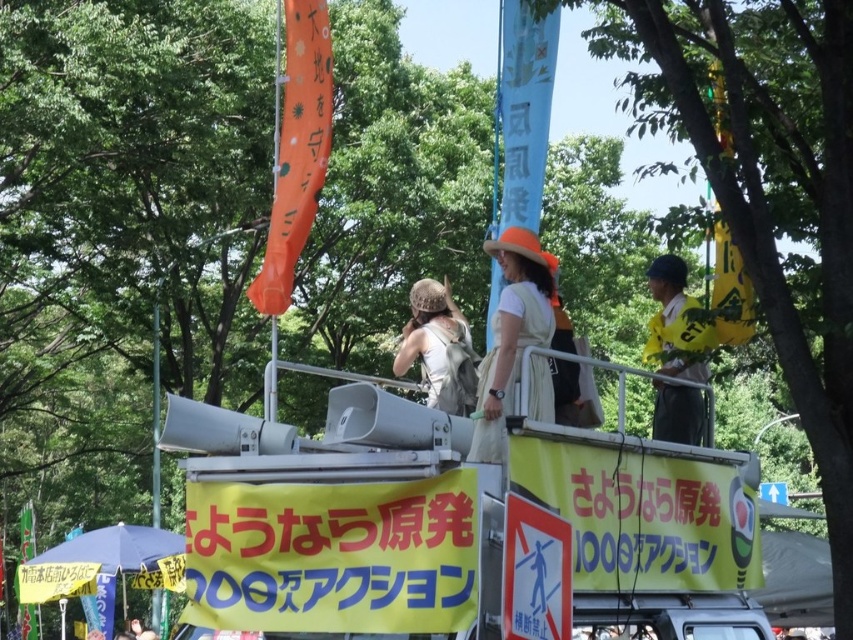
Question: From the image, what is the correct spatial relationship of yellow fabric shirt at right in relation to metallic pole at center?

Choices:
 (A) left
 (B) right

Answer: (B)

Question: Is matte orange hat at center further to the viewer compared to beige fabric hat at center?

Choices:
 (A) no
 (B) yes

Answer: (A)

Question: Considering the real-world distances, which object is closest to the blue fabric canopy at lower left?

Choices:
 (A) metallic pole at center
 (B) yellow fabric shirt at right

Answer: (A)

Question: Where is matte orange hat at center located in relation to yellow fabric shirt at right in the image?

Choices:
 (A) right
 (B) left

Answer: (B)

Question: Estimate the real-world distances between objects in this image. Which object is farther from the matte orange hat at center?

Choices:
 (A) yellow fabric shirt at right
 (B) blue fabric canopy at lower left

Answer: (B)

Question: Which object is farther from the camera taking this photo?

Choices:
 (A) beige fabric hat at center
 (B) matte orange hat at center

Answer: (A)